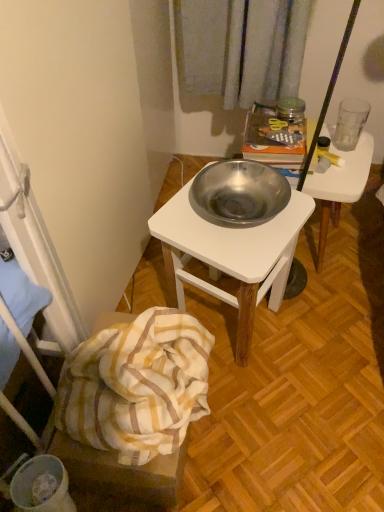
Question: Is white striped fabric at lower left completely or partially outside of polished stainless steel bowl at center, positioned as the 1th desk in left-to-right order?

Choices:
 (A) no
 (B) yes

Answer: (B)

Question: Is white striped fabric at lower left in front of polished stainless steel bowl at center, positioned as the 1th desk in left-to-right order?

Choices:
 (A) yes
 (B) no

Answer: (A)

Question: Considering the relative sizes of white striped fabric at lower left and polished stainless steel bowl at center, positioned as the 1th desk in left-to-right order, in the image provided, is white striped fabric at lower left thinner than polished stainless steel bowl at center, positioned as the 1th desk in left-to-right order,?

Choices:
 (A) yes
 (B) no

Answer: (A)

Question: From the image's perspective, does white striped fabric at lower left appear lower than polished stainless steel bowl at center, positioned as the 1th desk in left-to-right order?

Choices:
 (A) no
 (B) yes

Answer: (B)

Question: Is white striped fabric at lower left wider than polished stainless steel bowl at center, which is the second desk in right-to-left order?

Choices:
 (A) no
 (B) yes

Answer: (A)

Question: Is white striped fabric at lower left next to polished stainless steel bowl at center, positioned as the 1th desk in left-to-right order?

Choices:
 (A) no
 (B) yes

Answer: (A)

Question: Is the position of metallic white desk at center, marked as the first desk in a right-to-left arrangement, less distant than that of polished stainless steel bowl at center, which is the second desk in right-to-left order?

Choices:
 (A) no
 (B) yes

Answer: (A)

Question: From a real-world perspective, is metallic white desk at center, which is the 2th desk from left to right, located higher than polished stainless steel bowl at center, positioned as the 1th desk in left-to-right order?

Choices:
 (A) yes
 (B) no

Answer: (B)

Question: Considering the relative sizes of metallic white desk at center, marked as the first desk in a right-to-left arrangement, and polished stainless steel bowl at center, which is the second desk in right-to-left order, in the image provided, is metallic white desk at center, marked as the first desk in a right-to-left arrangement, taller than polished stainless steel bowl at center, which is the second desk in right-to-left order,?

Choices:
 (A) no
 (B) yes

Answer: (A)

Question: Is polished stainless steel bowl at center, which is the second desk in right-to-left order, inside metallic white desk at center, which is the 2th desk from left to right?

Choices:
 (A) yes
 (B) no

Answer: (B)

Question: Does metallic white desk at center, marked as the first desk in a right-to-left arrangement, have a lesser height compared to polished stainless steel bowl at center, which is the second desk in right-to-left order?

Choices:
 (A) yes
 (B) no

Answer: (A)

Question: Is metallic white desk at center, which is the 2th desk from left to right, thinner than polished stainless steel bowl at center, positioned as the 1th desk in left-to-right order?

Choices:
 (A) yes
 (B) no

Answer: (A)

Question: Does white striped fabric at lower left lie in front of metallic white desk at center, which is the 2th desk from left to right?

Choices:
 (A) yes
 (B) no

Answer: (A)